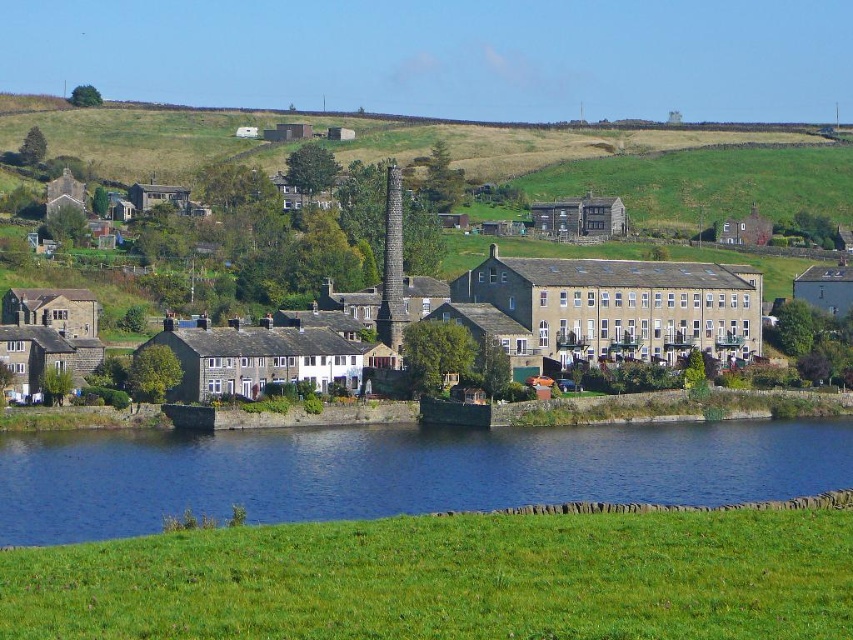
Is blue water at lower center to the left of stone buildings at center from the viewer's perspective?

No, blue water at lower center is not to the left of stone buildings at center.

Which is in front, point (459, 456) or point (486, 289)?

Positioned in front is point (459, 456).

The width and height of the screenshot is (853, 640). In order to click on blue water at lower center in this screenshot , I will do `click(398, 472)`.